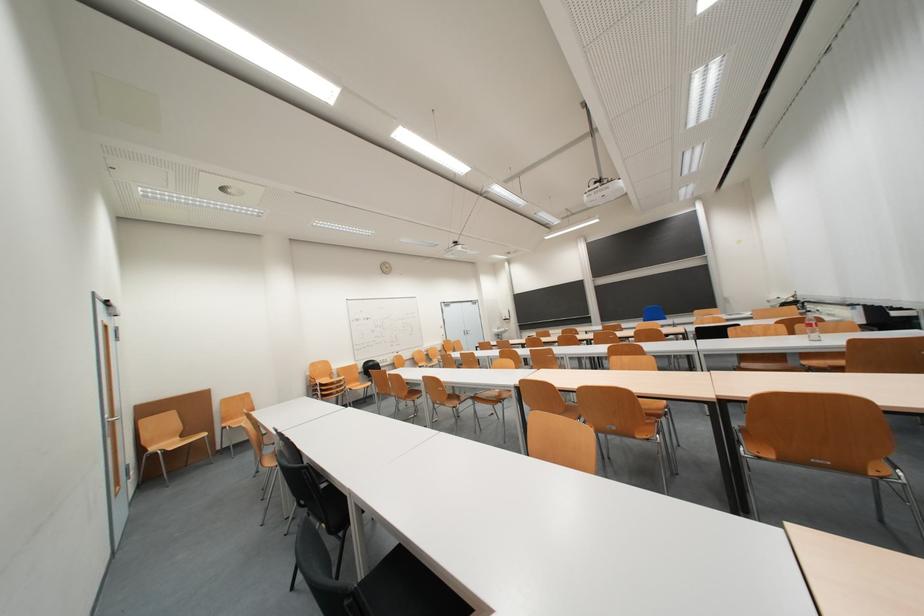
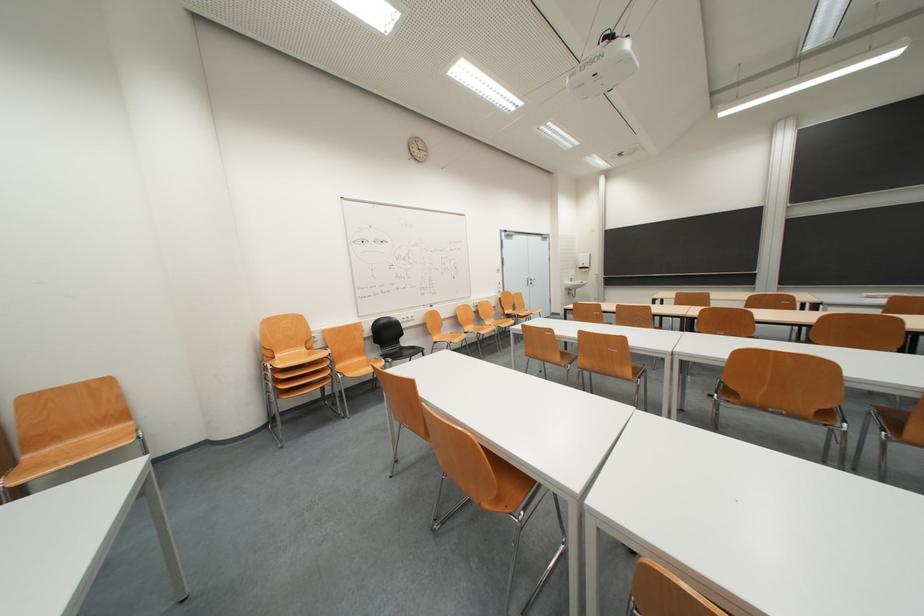
In the second image, find the point that corresponds to the point at 429,367 in the first image.

(476, 328)